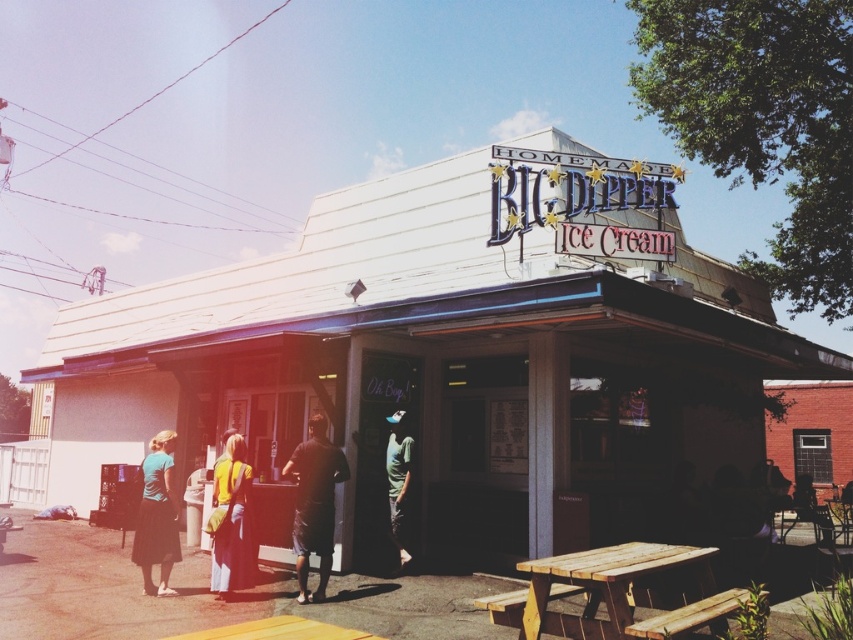
You are standing at the entrance of the shop and want to find the white corrugated metal building at center. In which direction should you look relative to your current position?

The white corrugated metal building at center is located directly in front of you since it is at the center point of the image.